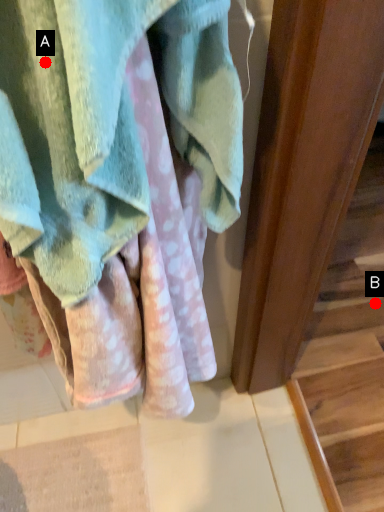
Question: Two points are circled on the image, labeled by A and B beside each circle. Which point is farther from the camera taking this photo?

Choices:
 (A) A is further
 (B) B is further

Answer: (B)